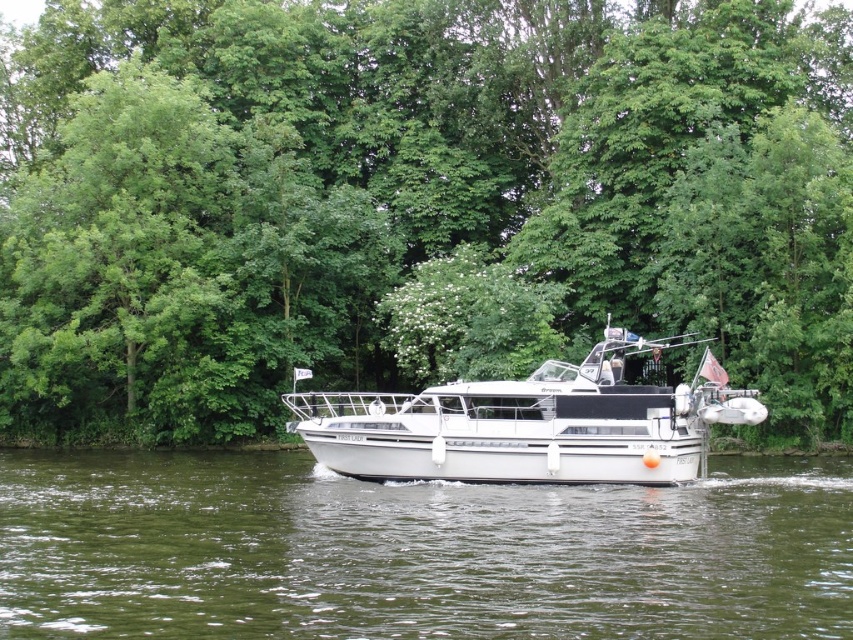
Is green leafy trees at center positioned at the back of green water at center?

Yes.

Does green leafy trees at center have a larger size compared to green water at center?

Indeed, green leafy trees at center has a larger size compared to green water at center.

Is point (688, 97) in front of point (131, 628)?

No, it is not.

The width and height of the screenshot is (853, 640). In order to click on green leafy trees at center in this screenshot , I will do `click(413, 202)`.

Can you confirm if green water at center is positioned to the left of white glossy boat at center?

Indeed, green water at center is positioned on the left side of white glossy boat at center.

Does point (271, 556) lie behind point (509, 435)?

No, it is in front of (509, 435).

The width and height of the screenshot is (853, 640). What do you see at coordinates (415, 552) in the screenshot?
I see `green water at center` at bounding box center [415, 552].

The width and height of the screenshot is (853, 640). What are the coordinates of `green water at center` in the screenshot? It's located at (415, 552).

Does green leafy trees at center appear over white glossy boat at center?

Yes.

How much distance is there between green leafy trees at center and white glossy boat at center?

They are 9.78 meters apart.

Is point (158, 336) closer to viewer compared to point (699, 384)?

No, (158, 336) is further to viewer.

The height and width of the screenshot is (640, 853). What are the coordinates of `green leafy trees at center` in the screenshot? It's located at (413, 202).